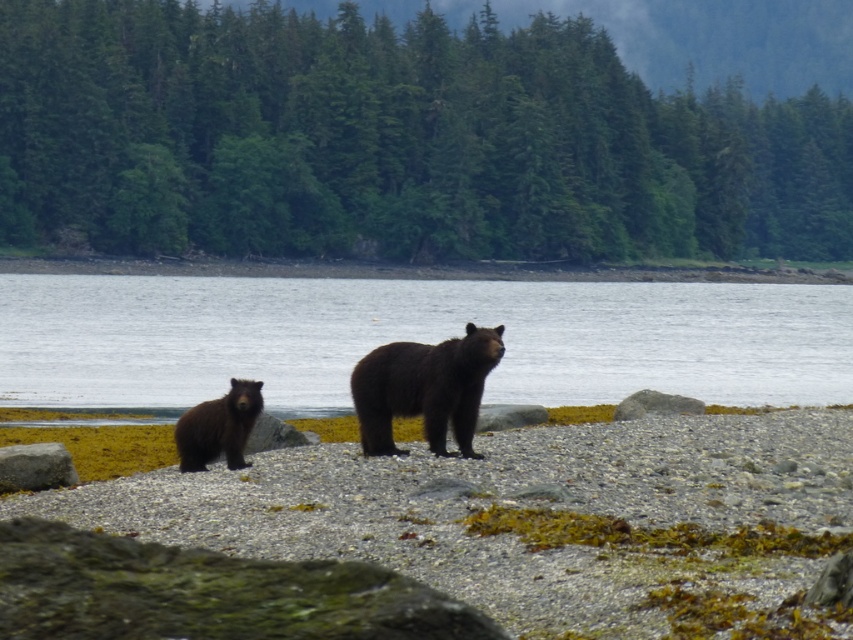
Find the location of `clear water at center`. clear water at center is located at coordinates (415, 339).

Can you confirm if clear water at center is positioned below gray rock at lower left?

Actually, clear water at center is above gray rock at lower left.

Does point (341, 282) come farther from viewer compared to point (50, 456)?

Yes, point (341, 282) is farther from viewer.

I want to click on clear water at center, so pos(415,339).

Locate an element on the screen. The height and width of the screenshot is (640, 853). shiny dark brown bear at center is located at coordinates (424, 388).

Can you confirm if shiny dark brown bear at center is positioned to the right of brown furry bear at lower left?

Indeed, shiny dark brown bear at center is positioned on the right side of brown furry bear at lower left.

Consider the image. Who is more distant from viewer, (486,337) or (259,406)?

→ Positioned behind is point (259,406).

At what (x,y) coordinates should I click in order to perform the action: click on shiny dark brown bear at center. Please return your answer as a coordinate pair (x, y). Image resolution: width=853 pixels, height=640 pixels. Looking at the image, I should click on (424, 388).

Which of these two, smooth gravel beach at center or shiny dark brown bear at center, stands shorter?

smooth gravel beach at center

In the scene shown: Can you confirm if smooth gravel beach at center is taller than shiny dark brown bear at center?

No, smooth gravel beach at center is not taller than shiny dark brown bear at center.

Is point (155, 500) more distant than point (352, 403)?

No, it is not.

The height and width of the screenshot is (640, 853). I want to click on smooth gravel beach at center, so click(538, 518).